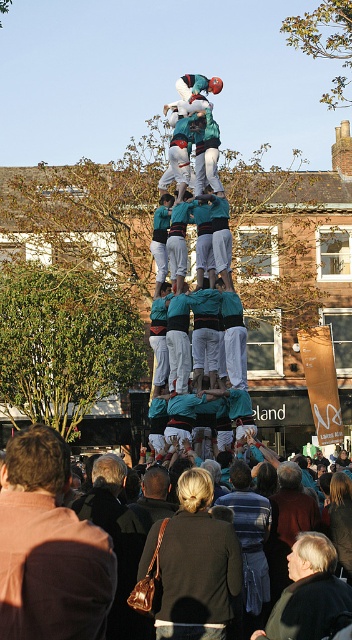
You are standing at the point labeled point [306,547] and want to take a photo of the castell. If the camera is 192.30 feet away from you, is the castell likely to be in focus in the photo?

The castell is likely to be in focus because the distance between you and the camera is 192.30 feet, which is a typical focal range for capturing such a subject clearly.

You are standing in a public square and see the dark blue jacket at center. If you want to reach the jacket quickly, how many steps would you need to take? Assume each step covers about 3 feet.

The dark blue jacket at center is 211.07 feet away from the viewer. Dividing this distance by the step length of 3 feet per step gives approximately 70.36 steps. Since you can only take whole steps, you would need to take 71 steps to reach the dark blue jacket at center.